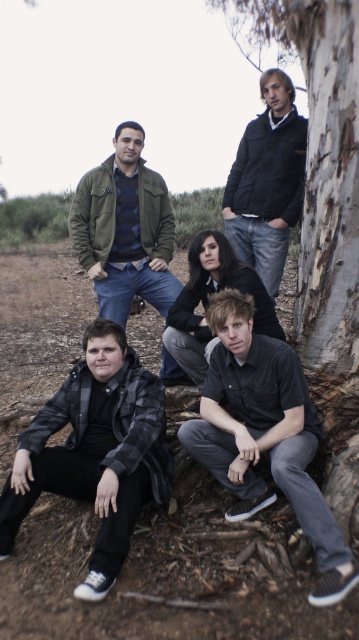
Based on the photo, you are standing in the scene and want to pick up both the leather jacket at lower left and the black cotton shirt at lower right. Which item should you bend down less to pick up?

The leather jacket at lower left is located below the black cotton shirt at lower right, so you would need to bend down less to pick up the black cotton shirt at lower right.

You are trying to decide which jacket to take from the group. Both the dark blue jacket at center and the black leather jacket at center are available. Which one is located to the right of the other?

The dark blue jacket at center is positioned on the right side of the black leather jacket at center.

You are standing at the point with coordinates 0.5, 0.5 in the image. You want to walk to the dirt ground at center. In which direction should you move?

The dirt ground at center is located at point (168, 570). Since you are at (179, 320), you should move towards the right and slightly downward to reach it.